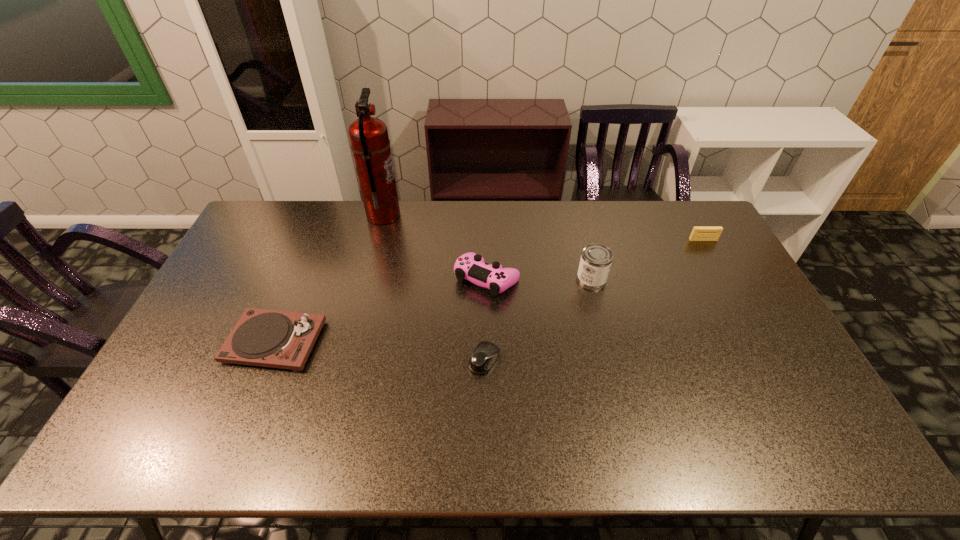
Image resolution: width=960 pixels, height=540 pixels. In the image, there is a desktop. Find the location of `free space at the far edge`. free space at the far edge is located at coordinates (415, 220).

I want to click on free space at the near edge of the desktop, so click(x=624, y=433).

You are a GUI agent. You are given a task and a screenshot of the screen. Output one action in this format:
    pyautogui.click(x=<x>, y=<y>)
    Task: Click on the free space at the left edge of the desktop
    
    Given the screenshot: What is the action you would take?
    pyautogui.click(x=177, y=370)

The image size is (960, 540). In the image, there is a desktop. Find the location of `vacant space at the right edge`. vacant space at the right edge is located at coordinates (732, 300).

The width and height of the screenshot is (960, 540). Identify the location of free space at the far right corner. (673, 232).

Find the location of a particular element. Image resolution: width=960 pixels, height=540 pixels. free area in between the mouse and the can is located at coordinates (538, 320).

At what (x,y) coordinates should I click in order to perform the action: click on vacant point located between the shortest object and the fifth shortest object. Please return your answer as a coordinate pair (x, y). Looking at the image, I should click on (538, 320).

This screenshot has height=540, width=960. What are the coordinates of `free point between the shortest object and the control` in the screenshot? It's located at (486, 319).

Where is `free spot between the fifth shortest object and the rightmost object`? The width and height of the screenshot is (960, 540). free spot between the fifth shortest object and the rightmost object is located at coordinates (647, 260).

The width and height of the screenshot is (960, 540). What are the coordinates of `vacant point located between the videotape and the tallest object` in the screenshot? It's located at (543, 228).